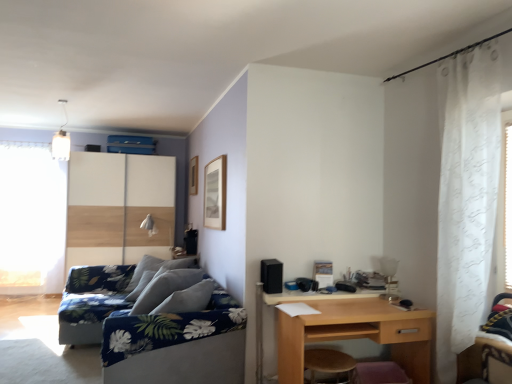
Question: Is wooden stool at lower center taller than white sheer curtain at left?

Choices:
 (A) no
 (B) yes

Answer: (A)

Question: Considering the relative positions of wooden stool at lower center and white sheer curtain at left in the image provided, is wooden stool at lower center to the left of white sheer curtain at left from the viewer's perspective?

Choices:
 (A) no
 (B) yes

Answer: (A)

Question: Does wooden stool at lower center have a greater width compared to white sheer curtain at left?

Choices:
 (A) no
 (B) yes

Answer: (B)

Question: From a real-world perspective, is wooden stool at lower center located beneath white sheer curtain at left?

Choices:
 (A) no
 (B) yes

Answer: (B)

Question: Is wooden stool at lower center far away from white sheer curtain at left?

Choices:
 (A) no
 (B) yes

Answer: (B)

Question: Would you say wooden stool at lower center contains white sheer curtain at left?

Choices:
 (A) yes
 (B) no

Answer: (B)

Question: Could you tell me if wooden stool at lower center is facing light brown wood desk at lower right?

Choices:
 (A) no
 (B) yes

Answer: (B)

Question: From a real-world perspective, does wooden stool at lower center sit lower than light brown wood desk at lower right?

Choices:
 (A) yes
 (B) no

Answer: (A)

Question: Does wooden stool at lower center have a larger size compared to light brown wood desk at lower right?

Choices:
 (A) no
 (B) yes

Answer: (A)

Question: Can we say wooden stool at lower center lies outside light brown wood desk at lower right?

Choices:
 (A) yes
 (B) no

Answer: (B)

Question: Does wooden stool at lower center have a smaller size compared to light brown wood desk at lower right?

Choices:
 (A) no
 (B) yes

Answer: (B)

Question: Does wooden stool at lower center come behind light brown wood desk at lower right?

Choices:
 (A) no
 (B) yes

Answer: (B)

Question: Can you confirm if blue floral fabric couch at lower left is wider than wooden sliding door at left?

Choices:
 (A) yes
 (B) no

Answer: (A)